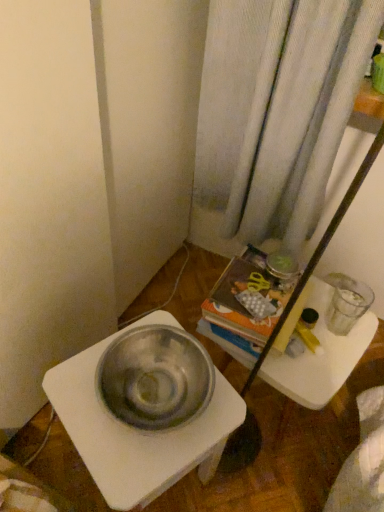
Image resolution: width=384 pixels, height=512 pixels. I want to click on translucent plastic tray at center, so click(319, 355).

This screenshot has width=384, height=512. Describe the element at coordinates (319, 355) in the screenshot. I see `translucent plastic tray at center` at that location.

Measure the distance between point (329, 295) and camera.

Point (329, 295) is 1.17 meters away from camera.

The width and height of the screenshot is (384, 512). What do you see at coordinates (137, 430) in the screenshot? I see `metallic white table at lower left` at bounding box center [137, 430].

Where is `metallic white table at lower left`? Image resolution: width=384 pixels, height=512 pixels. metallic white table at lower left is located at coordinates (137, 430).

What is the approximate width of metallic white table at lower left?

It is 12.73 inches.

The width and height of the screenshot is (384, 512). Identify the location of translucent plastic tray at center. (319, 355).

Does metallic white table at lower left appear on the right side of translucent plastic tray at center?

In fact, metallic white table at lower left is to the left of translucent plastic tray at center.

Considering their positions, is metallic white table at lower left located in front of or behind translucent plastic tray at center?

Visually, metallic white table at lower left is located in front of translucent plastic tray at center.

Is point (127, 477) closer or farther from the camera than point (344, 361)?

Point (127, 477) is closer to the camera than point (344, 361).

From the image's perspective, is metallic white table at lower left located above or below translucent plastic tray at center?

Based on their image positions, metallic white table at lower left is located beneath translucent plastic tray at center.

From a real-world perspective, is metallic white table at lower left positioned above or below translucent plastic tray at center?

From a real-world perspective, metallic white table at lower left is physically above translucent plastic tray at center.

Is metallic white table at lower left wider or thinner than translucent plastic tray at center?

Clearly, metallic white table at lower left has more width compared to translucent plastic tray at center.

Considering the sizes of metallic white table at lower left and translucent plastic tray at center in the image, is metallic white table at lower left taller or shorter than translucent plastic tray at center?

metallic white table at lower left is taller than translucent plastic tray at center.

Who is smaller, metallic white table at lower left or translucent plastic tray at center?

translucent plastic tray at center.

Does metallic white table at lower left contain translucent plastic tray at center?

No, translucent plastic tray at center is not inside metallic white table at lower left.

Is metallic white table at lower left with translucent plastic tray at center?

metallic white table at lower left is not next to translucent plastic tray at center, and they're not touching.

Does metallic white table at lower left turn towards translucent plastic tray at center?

No, metallic white table at lower left does not turn towards translucent plastic tray at center.

What's the angular difference between metallic white table at lower left and translucent plastic tray at center's facing directions?

There is a 12.9-degree angle between the facing directions of metallic white table at lower left and translucent plastic tray at center.

How far apart are metallic white table at lower left and translucent plastic tray at center?

metallic white table at lower left is 11.35 inches away from translucent plastic tray at center.

Identify the location of vanity lying above the metallic white table at lower left (from the image's perspective). Image resolution: width=384 pixels, height=512 pixels. 319,355.

Does translucent plastic tray at center appear on the left side of metallic white table at lower left?

Incorrect, translucent plastic tray at center is not on the left side of metallic white table at lower left.

Based on the photo, which object is further away from the camera taking this photo, translucent plastic tray at center or metallic white table at lower left?

translucent plastic tray at center is more distant.

Is point (249, 366) closer to viewer compared to point (78, 360)?

No, it is not.

From the image's perspective, who appears lower, translucent plastic tray at center or metallic white table at lower left?

metallic white table at lower left appears lower in the image.

From a real-world perspective, who is located lower, translucent plastic tray at center or metallic white table at lower left?

From a 3D spatial view, translucent plastic tray at center is below.

Consider the image. Looking at their sizes, would you say translucent plastic tray at center is wider or thinner than metallic white table at lower left?

Clearly, translucent plastic tray at center has less width compared to metallic white table at lower left.

Is translucent plastic tray at center taller or shorter than metallic white table at lower left?

translucent plastic tray at center is shorter than metallic white table at lower left.

Is translucent plastic tray at center smaller than metallic white table at lower left?

Correct, translucent plastic tray at center occupies less space than metallic white table at lower left.

Is translucent plastic tray at center situated inside metallic white table at lower left or outside?

translucent plastic tray at center is spatially situated outside metallic white table at lower left.

Would you say translucent plastic tray at center is a long distance from metallic white table at lower left?

No.

Is translucent plastic tray at center aimed at metallic white table at lower left?

No, translucent plastic tray at center is not aimed at metallic white table at lower left.

Can you tell me how much translucent plastic tray at center and metallic white table at lower left differ in facing direction?

12.9 degrees separate the facing orientations of translucent plastic tray at center and metallic white table at lower left.

How far apart are translucent plastic tray at center and metallic white table at lower left?

translucent plastic tray at center is 11.35 inches away from metallic white table at lower left.

This screenshot has width=384, height=512. In the image, there is a translucent plastic tray at center. What are the coordinates of `table below it (from the image's perspective)` in the screenshot? It's located at (137, 430).

Identify the location of table located on the left of translucent plastic tray at center. (137, 430).

Find the location of a particular element. vanity on the right of metallic white table at lower left is located at coordinates (319, 355).